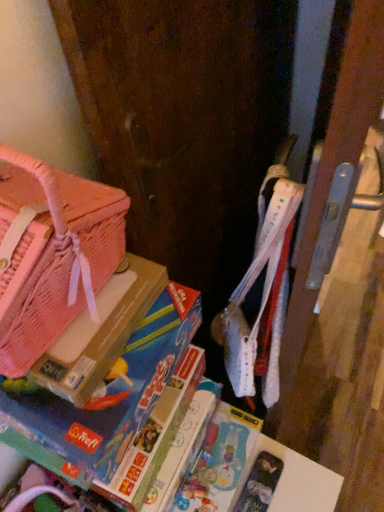
Question: Is pink woven handbag at left outside pink mesh bag at left?

Choices:
 (A) yes
 (B) no

Answer: (A)

Question: Can you confirm if pink woven handbag at left is positioned to the left of pink mesh bag at left?

Choices:
 (A) yes
 (B) no

Answer: (A)

Question: From a real-world perspective, is pink woven handbag at left on top of pink mesh bag at left?

Choices:
 (A) no
 (B) yes

Answer: (B)

Question: Can you confirm if pink woven handbag at left is shorter than pink mesh bag at left?

Choices:
 (A) no
 (B) yes

Answer: (A)

Question: From the image's perspective, is pink woven handbag at left above pink mesh bag at left?

Choices:
 (A) no
 (B) yes

Answer: (B)

Question: Is pink woven handbag at left oriented towards pink mesh bag at left?

Choices:
 (A) yes
 (B) no

Answer: (B)

Question: Is pink mesh bag at left facing away from blue cardboard game at left?

Choices:
 (A) yes
 (B) no

Answer: (B)

Question: Does pink mesh bag at left have a greater height compared to blue cardboard game at left?

Choices:
 (A) no
 (B) yes

Answer: (A)

Question: From a real-world perspective, is pink mesh bag at left positioned over blue cardboard game at left based on gravity?

Choices:
 (A) yes
 (B) no

Answer: (A)

Question: From the image's perspective, is pink mesh bag at left located beneath blue cardboard game at left?

Choices:
 (A) no
 (B) yes

Answer: (A)

Question: Is the depth of pink mesh bag at left less than that of blue cardboard game at left?

Choices:
 (A) no
 (B) yes

Answer: (A)

Question: Is pink mesh bag at left in contact with blue cardboard game at left?

Choices:
 (A) yes
 (B) no

Answer: (A)

Question: Can you confirm if blue cardboard game at left is taller than pink mesh bag at left?

Choices:
 (A) yes
 (B) no

Answer: (A)